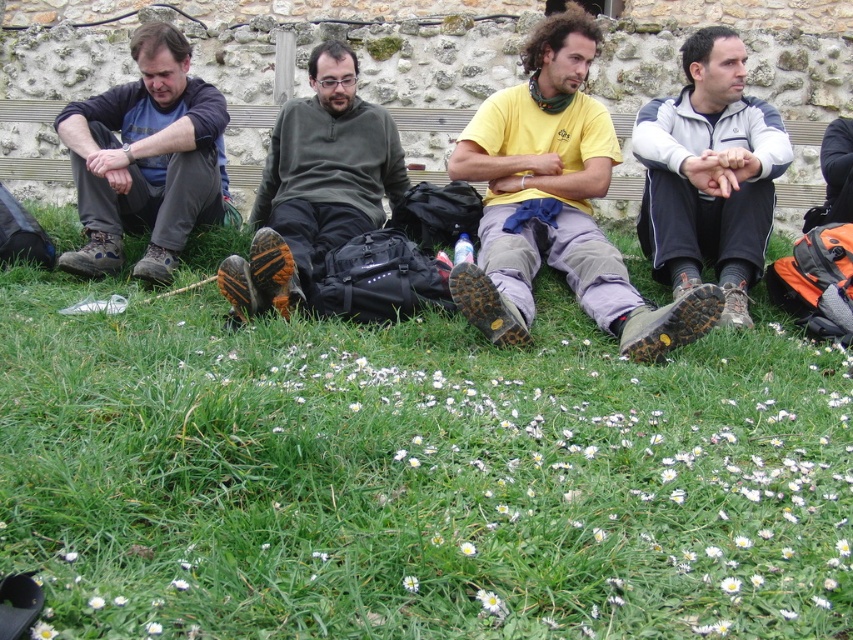
Question: Which object is positioned farthest from the green grass at lower center?

Choices:
 (A) dark blue fleece at left
 (B) dark green fabric pants at center
 (C) gray fleece jacket at right

Answer: (C)

Question: From the image, what is the correct spatial relationship of yellow matte shirt at center in relation to dark green fabric pants at center?

Choices:
 (A) below
 (B) above

Answer: (B)

Question: Does yellow matte shirt at center have a smaller size compared to dark blue fleece at left?

Choices:
 (A) yes
 (B) no

Answer: (B)

Question: Which object is farther from the camera taking this photo?

Choices:
 (A) dark blue fleece at left
 (B) yellow matte shirt at center
 (C) green grass at lower center
 (D) gray fleece jacket at right

Answer: (A)

Question: Which object is the closest to the green grass at lower center?

Choices:
 (A) dark blue fleece at left
 (B) gray fleece jacket at right
 (C) dark green fabric pants at center

Answer: (C)

Question: Is yellow matte shirt at center smaller than gray fleece jacket at right?

Choices:
 (A) yes
 (B) no

Answer: (B)